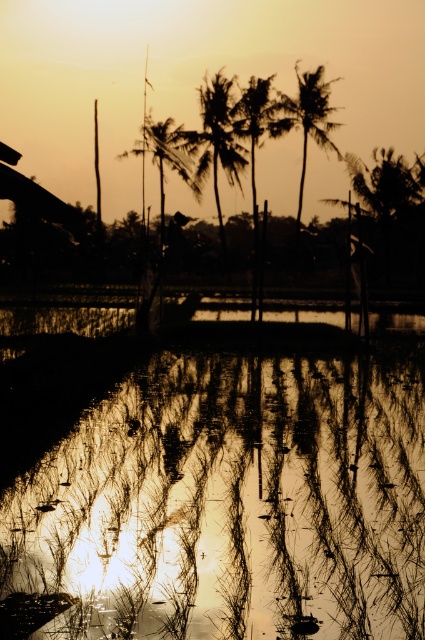
You are a photographer trying to capture the reflection of the palm trees in the shiny reflective water at center. Based on the coordinates provided, where should you position your camera to ensure the reflection is centered in your shot?

The shiny reflective water at center is located at coordinates point (209, 477), so you should position your camera directly above or aligned with those coordinates to center the reflection in your shot.